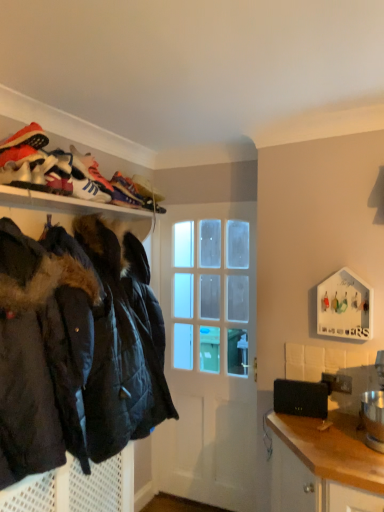
You are a GUI agent. You are given a task and a screenshot of the screen. Output one action in this format:
    pyautogui.click(x=<x>, y=<y>)
    Task: Click on the black quilted jacket at left
    The width and height of the screenshot is (384, 512).
    Given the screenshot: What is the action you would take?
    pyautogui.click(x=76, y=347)

Measure the distance between matte black jackets at upper left and camera.

The distance of matte black jackets at upper left from camera is 1.65 meters.

Locate an element on the screen. matte black jackets at upper left is located at coordinates (76, 208).

The image size is (384, 512). In order to click on black matte laptop at lower right in this screenshot , I will do `click(301, 398)`.

Is black quilted jacket at lower left in contact with black matte laptop at lower right?

No, black quilted jacket at lower left is not making contact with black matte laptop at lower right.

Which object is closer to the camera, black quilted jacket at lower left or black matte laptop at lower right?

Positioned in front is black quilted jacket at lower left.

From a real-world perspective, which object rests below the other?

In real-world perspective, black quilted jacket at lower left is lower.

Measure the distance between black quilted jacket at lower left and black matte laptop at lower right.

black quilted jacket at lower left and black matte laptop at lower right are 1.05 meters apart.

From their relative heights in the image, would you say white leather sneaker at upper left is taller or shorter than matte black jackets at upper left?

white leather sneaker at upper left is shorter than matte black jackets at upper left.

Which object is positioned more to the right, white leather sneaker at upper left or matte black jackets at upper left?

white leather sneaker at upper left is more to the right.

Would you say white leather sneaker at upper left is inside or outside matte black jackets at upper left?

white leather sneaker at upper left is outside matte black jackets at upper left.

From the image's perspective, does black quilted jacket at left appear higher than matte black jackets at upper left?

No, from the image's perspective, black quilted jacket at left is not over matte black jackets at upper left.

Is the surface of black quilted jacket at left in direct contact with matte black jackets at upper left?

No, black quilted jacket at left is not next to matte black jackets at upper left.

Between black quilted jacket at left and matte black jackets at upper left, which one is positioned behind?

matte black jackets at upper left is further away from the camera.

Considering the positions of objects white leather sneaker at upper left and black matte laptop at lower right in the image provided, who is more to the right, white leather sneaker at upper left or black matte laptop at lower right?

black matte laptop at lower right.

From a real-world perspective, is white leather sneaker at upper left under black matte laptop at lower right?

No, from a real-world perspective, white leather sneaker at upper left is not below black matte laptop at lower right.

Is white leather sneaker at upper left directly adjacent to black matte laptop at lower right?

white leather sneaker at upper left and black matte laptop at lower right are clearly separated.

Consider the image. Is white leather sneaker at upper left inside or outside of black matte laptop at lower right?

white leather sneaker at upper left is spatially situated outside black matte laptop at lower right.

Are black quilted jacket at left and white leather sneaker at upper left beside each other?

black quilted jacket at left and white leather sneaker at upper left are not in contact.

Could you tell me if black quilted jacket at left is turned towards white leather sneaker at upper left?

No, black quilted jacket at left is not turned towards white leather sneaker at upper left.

From the image's perspective, does black quilted jacket at left appear higher than white leather sneaker at upper left?

No, from the image's perspective, black quilted jacket at left is not on top of white leather sneaker at upper left.

Between black quilted jacket at left and white leather sneaker at upper left, which one has smaller size?

Smaller between the two is white leather sneaker at upper left.

Between black matte laptop at lower right and white glossy door at center, which one is positioned in front?

Answer: black matte laptop at lower right.

Looking at this image, from a real-world perspective, is black matte laptop at lower right under white glossy door at center?

Yes, from a real-world perspective, black matte laptop at lower right is beneath white glossy door at center.

Can you tell me how much black matte laptop at lower right and white glossy door at center differ in facing direction?

6.64 degrees.

Is black matte laptop at lower right touching white glossy door at center?

No, black matte laptop at lower right is not touching white glossy door at center.

Between black matte laptop at lower right and black quilted jacket at left, which one has more height?

Standing taller between the two is black quilted jacket at left.

From a real-world perspective, which object stands above the other?

From a 3D spatial view, black quilted jacket at left is above.

Between black matte laptop at lower right and black quilted jacket at left, which one appears on the right side from the viewer's perspective?

Positioned to the right is black matte laptop at lower right.

Identify the location of laptop located above the black quilted jacket at lower left (from a real-world perspective). (301, 398).

The width and height of the screenshot is (384, 512). What are the coordinates of `shelf that appears below the white leather sneaker at upper left (from the image's perspective)` in the screenshot? It's located at click(76, 208).

Based on their spatial positions, is black quilted jacket at lower left or white leather sneaker at upper left further from black matte laptop at lower right?

The object further to black matte laptop at lower right is white leather sneaker at upper left.

Looking at the image, which one is located closer to black matte laptop at lower right, black quilted jacket at left or white leather sneaker at upper left?

Based on the image, black quilted jacket at left appears to be nearer to black matte laptop at lower right.

From the image, which object appears to be nearer to black quilted jacket at lower left, white leather sneaker at upper left or white glossy door at center?

white glossy door at center is closer to black quilted jacket at lower left.

From the image, which object appears to be nearer to black quilted jacket at lower left, black quilted jacket at left or black matte laptop at lower right?

black quilted jacket at left is closer to black quilted jacket at lower left.

Which object lies nearer to the anchor point black quilted jacket at left, matte black jackets at upper left or black quilted jacket at lower left?

The object closer to black quilted jacket at left is matte black jackets at upper left.

When comparing their distances from black quilted jacket at left, does white leather sneaker at upper left or white glossy door at center seem closer?

white leather sneaker at upper left is positioned closer to the anchor black quilted jacket at left.

Considering their positions, is black quilted jacket at left positioned further to matte black jackets at upper left than white glossy door at center?

white glossy door at center is further to matte black jackets at upper left.

Based on their spatial positions, is black quilted jacket at left or black matte laptop at lower right further from matte black jackets at upper left?

The object further to matte black jackets at upper left is black matte laptop at lower right.

The height and width of the screenshot is (512, 384). Find the location of `door that lies between white leather sneaker at upper left and black matte laptop at lower right from top to bottom`. door that lies between white leather sneaker at upper left and black matte laptop at lower right from top to bottom is located at coordinates point(209,353).

This screenshot has height=512, width=384. Identify the location of jacket situated between matte black jackets at upper left and black matte laptop at lower right from left to right. (76, 347).

This screenshot has width=384, height=512. In order to click on door that lies between matte black jackets at upper left and black quilted jacket at lower left from top to bottom in this screenshot , I will do `click(209, 353)`.

At what (x,y) coordinates should I click in order to perform the action: click on jacket between matte black jackets at upper left and black quilted jacket at lower left in the vertical direction. Please return your answer as a coordinate pair (x, y). The height and width of the screenshot is (512, 384). Looking at the image, I should click on (76, 347).